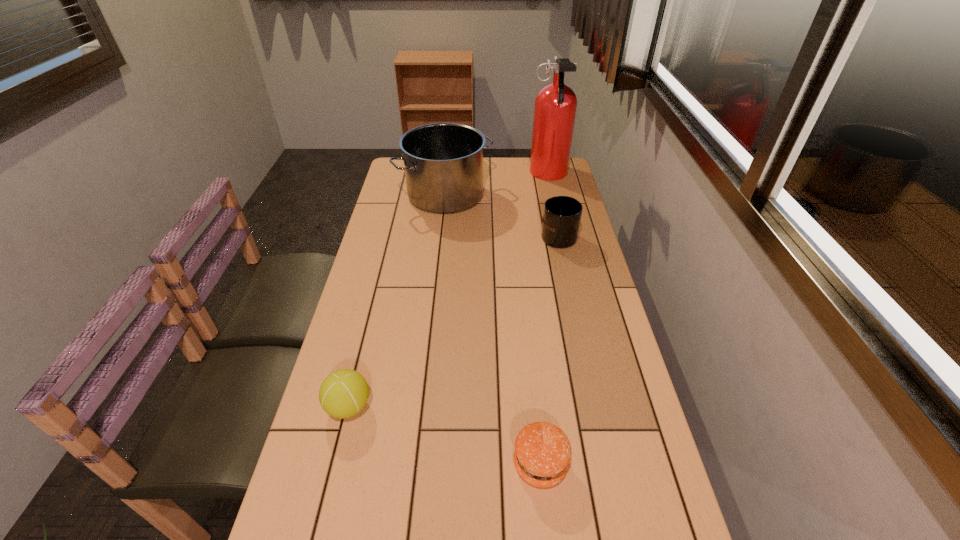
Find the location of a particular element. The height and width of the screenshot is (540, 960). vacant space situated with the handle on the side of the third shortest object is located at coordinates (544, 172).

This screenshot has width=960, height=540. Find the location of `vacant space situated 0.370m with the handle on the side of the third shortest object`. vacant space situated 0.370m with the handle on the side of the third shortest object is located at coordinates pyautogui.click(x=544, y=172).

Image resolution: width=960 pixels, height=540 pixels. Find the location of `free space located 0.320m with the handle on the side of the third shortest object`. free space located 0.320m with the handle on the side of the third shortest object is located at coordinates (x=545, y=178).

Find the location of a particular element. vacant space located on the right of the fourth tallest object is located at coordinates (516, 407).

Find the location of a particular element. This screenshot has height=540, width=960. vacant region located 0.370m on the left of the shortest object is located at coordinates (340, 464).

Find the location of a particular element. fire extinguisher that is at the far edge is located at coordinates pyautogui.click(x=555, y=105).

Locate an element on the screen. The width and height of the screenshot is (960, 540). saucepan that is at the far edge is located at coordinates (443, 162).

Where is `saucepan that is positioned at the left edge`? saucepan that is positioned at the left edge is located at coordinates (443, 162).

I want to click on tennis ball located in the left edge section of the desktop, so click(343, 393).

What are the coordinates of `fire extinguisher that is at the right edge` in the screenshot? It's located at click(555, 105).